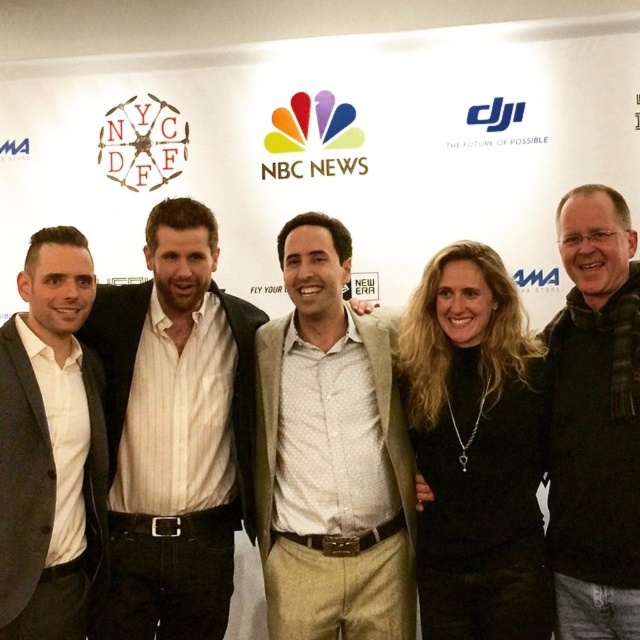
In the scene shown: You are a photographer arranging a group photo. You have two key subjects wearing the black wool sweater at right and the white matte suit at left. Based on the scene description, which subject is standing to the right of the other?

The black wool sweater at right is positioned on the right side of the white matte suit at left, so the subject in the black wool sweater at right is standing to the right of the subject in the white matte suit at left.

In the scene shown: You are a photographer adjusting the camera settings to ensure all subjects are in focus. Given that the white striped shirt at center and the light beige textured blazer at center are both at the center, which one is positioned closer to the camera?

The white striped shirt at center is much taller as light beige textured blazer at center, meaning it is positioned closer to the camera.